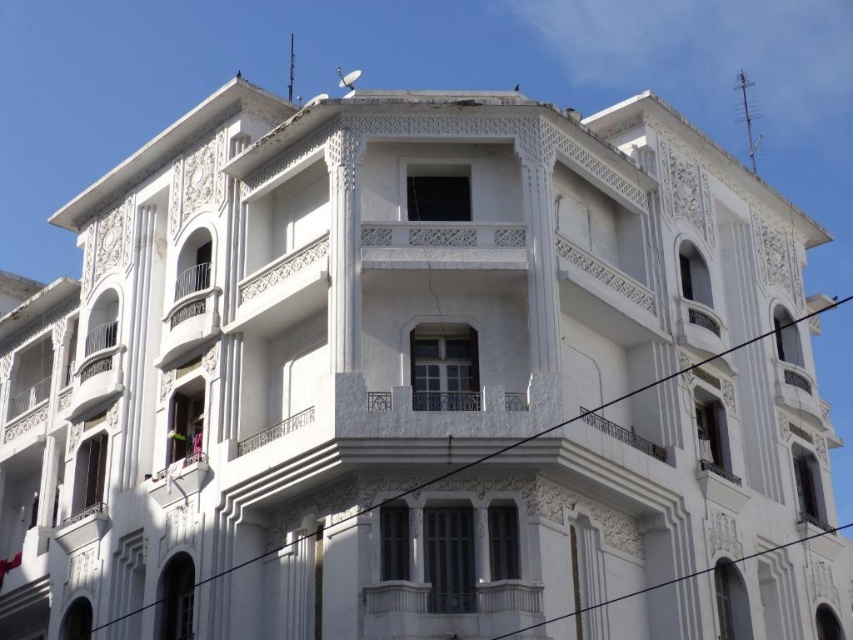
You are an architect analyzing the building facade. You notice a point marked at coordinates (598, 406). What feature is located at this point?

The point at coordinates (598, 406) marks the location of a black wire at center.

You are a maintenance worker needing to inspect two wires in the building. The black wire at center and the metallic wire at lower right are part of the same electrical system. Given that your ladder can extend up to 9 meters, can you safely reach both wires without moving the ladder?

The black wire at center and metallic wire at lower right are 9.19 meters apart from each other. Since the ladder can only extend up to 9 meters, it is not long enough to safely reach both wires without moving the ladder.

You are an electrician assessing the building for potential repairs. You notice two wires in the image. The first is the black wire at center, and the second is the metallic wire at lower right. Which wire should you prioritize checking if you suspect a fault related to electrical conductivity issues?

The metallic wire at lower right should be prioritized for checking because metal is a better conductor of electricity than rubber or plastic, so if there is an issue with electrical conductivity, it is more likely to be with the metallic wire at lower right.